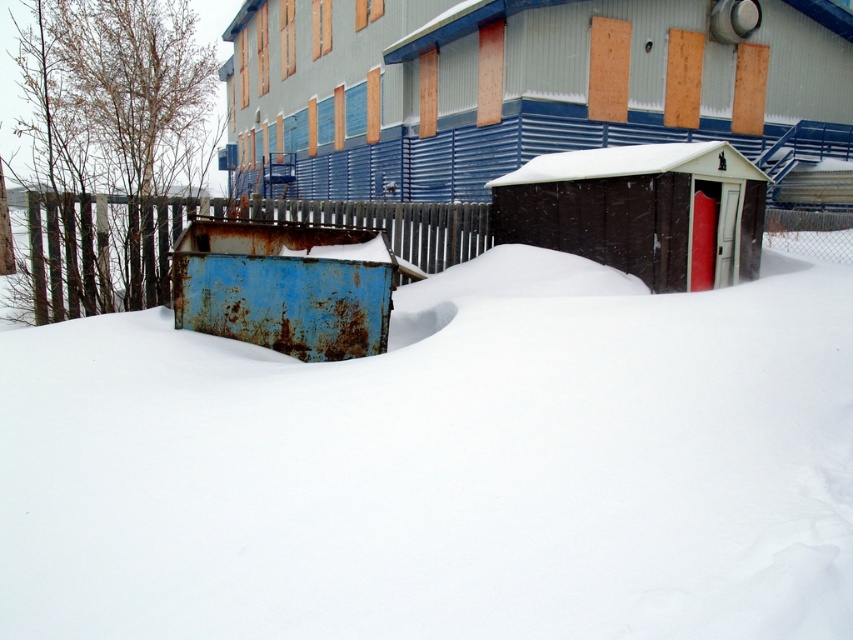
You are standing at the center of the snowy area and want to go to the brown wooden shed at upper center. Which direction should you head towards?

The brown wooden shed at upper center is located at point (532, 88), so you should head towards the upper center direction to reach it.

You are an observer standing in the snowy scene. You notice the white fluffy snow at center and the rusty metal fence at center. Which object takes up more space in the image?

The rusty metal fence at center takes up more space in the image because the white fluffy snow at center is smaller than the rusty metal fence at center.

You are standing in the snowy scene and want to walk from the white fluffy snow at center to the brown wooden shed at upper center. Which direction should you move to get closer to the shed?

Since the white fluffy snow at center is closer to the viewer than the brown wooden shed at upper center, you should move backward to get closer to the shed.